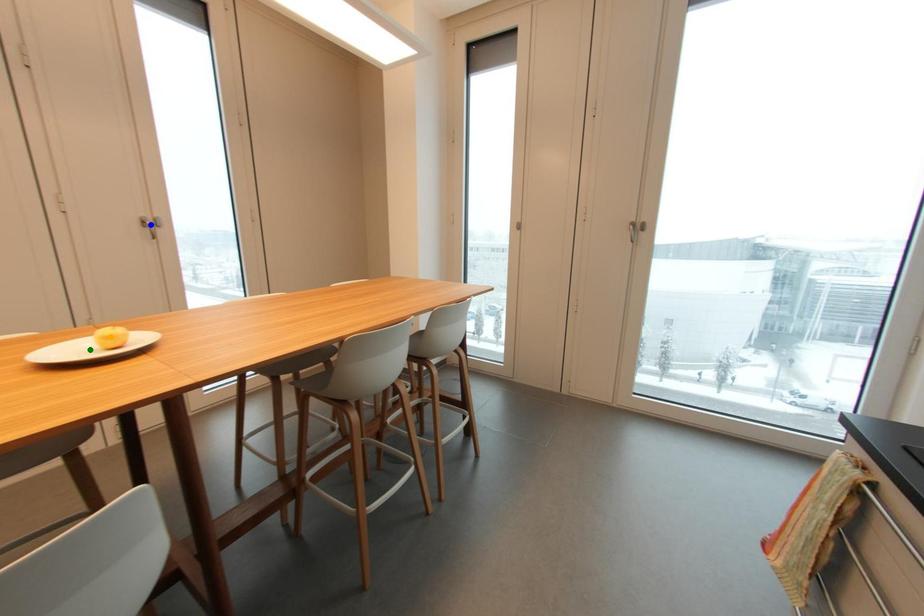
Order these from nearest to farthest:
1. orange point
2. green point
3. blue point

1. blue point
2. green point
3. orange point